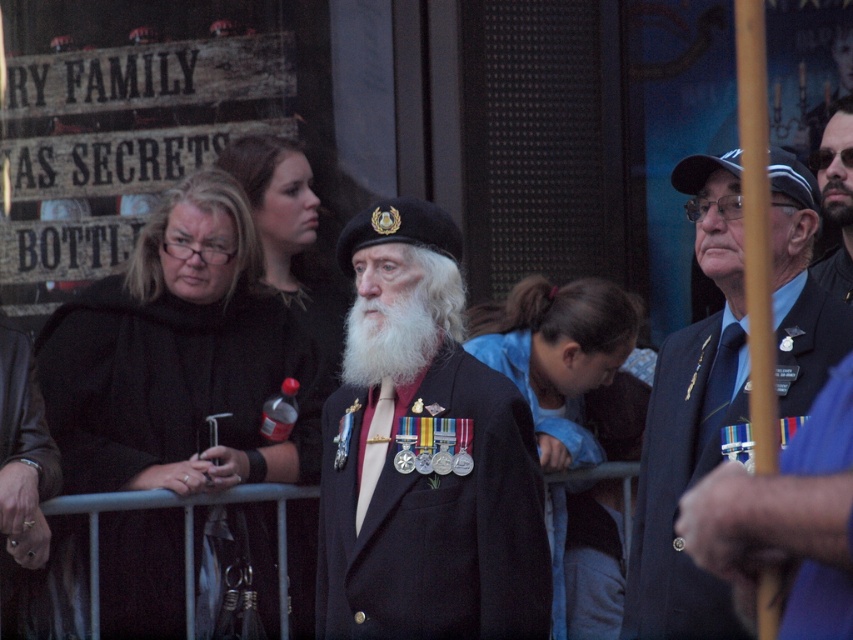
You are a photographer at the event and want to capture a photo of both the white matte beard at center and the bearded man at center. Given that your camera has a maximum focus range of 15 meters, will you be able to include both subjects in a single focused shot?

The white matte beard at center and bearded man at center are 16.85 meters apart. Since the distance between them exceeds the camera maximum focus range of 15 meters, the camera cannot focus on both subjects simultaneously in a single shot.

You are a photographer at the event and need to capture a photo of both the dark blue wool jacket at center and the shiny black suit at center. Which one should you focus on first if you want to ensure both are in frame without moving the camera?

The dark blue wool jacket at center is not as tall as the shiny black suit at center, so you should focus on the taller shiny black suit at center first to ensure it fits within the frame.